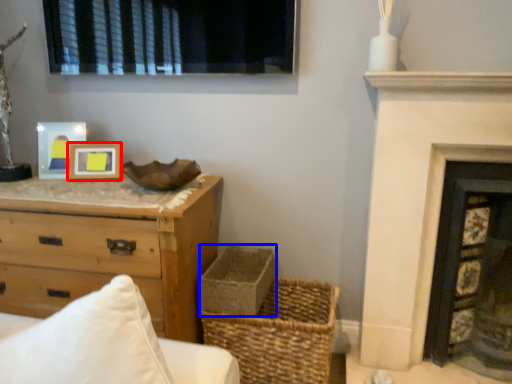
Question: Which object appears closest to the camera in this image, picture frame (highlighted by a red box) or basket container (highlighted by a blue box)?

Choices:
 (A) picture frame
 (B) basket container

Answer: (B)